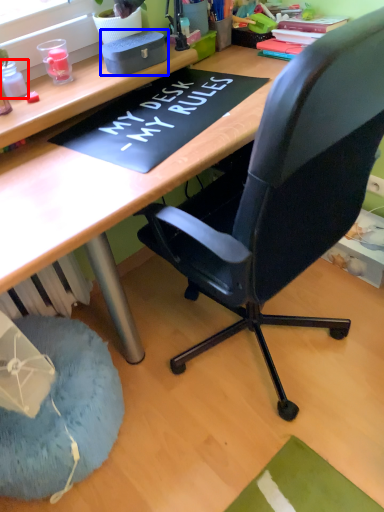
Question: Which object appears closest to the camera in this image, stationery (highlighted by a red box) or stationery (highlighted by a blue box)?

Choices:
 (A) stationery
 (B) stationery

Answer: (A)